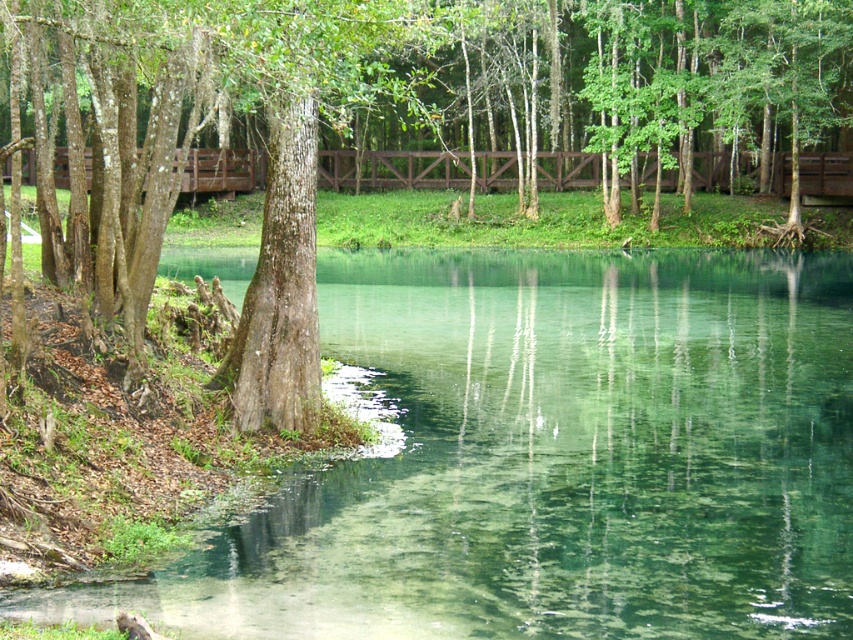
Question: Which object is farther from the camera taking this photo?

Choices:
 (A) smooth bark tree at left
 (B) clear glassy water at center

Answer: (A)

Question: Does clear glassy water at center appear on the right side of smooth bark tree at left?

Choices:
 (A) no
 (B) yes

Answer: (B)

Question: Which of the following is the closest to the observer?

Choices:
 (A) clear glassy water at center
 (B) smooth bark tree at left

Answer: (A)

Question: Is clear glassy water at center to the left of smooth bark tree at left from the viewer's perspective?

Choices:
 (A) no
 (B) yes

Answer: (A)

Question: Where is clear glassy water at center located in relation to smooth bark tree at left in the image?

Choices:
 (A) left
 (B) right

Answer: (B)